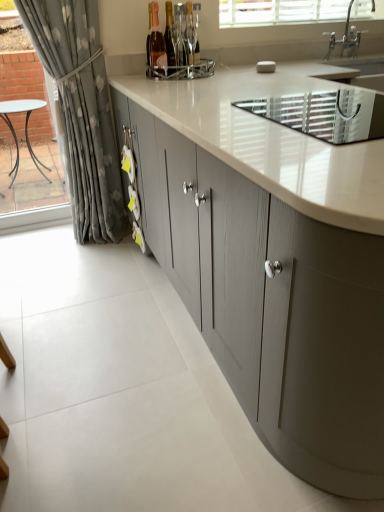
This screenshot has height=512, width=384. I want to click on vacant space in front of gray floral fabric curtain at left, so click(74, 275).